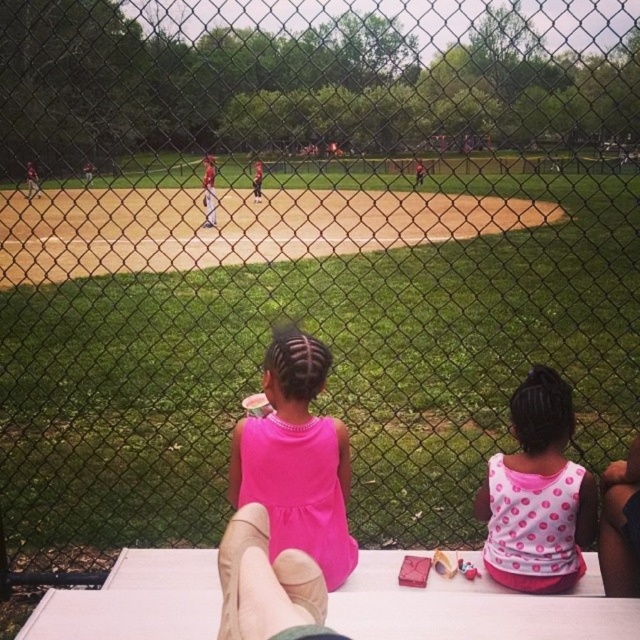
Question: Can you confirm if white wood picnic table at lower center is bigger than pink matte dress at center?

Choices:
 (A) yes
 (B) no

Answer: (B)

Question: Which point is farther to the camera?

Choices:
 (A) pink polka dot tank top at center
 (B) white wood picnic table at lower center
 (C) pink matte dress at center

Answer: (A)

Question: Which object is farther from the camera taking this photo?

Choices:
 (A) pink matte dress at center
 (B) white wood picnic table at lower center

Answer: (A)

Question: Is white wood picnic table at lower center to the left of pink matte dress at center from the viewer's perspective?

Choices:
 (A) yes
 (B) no

Answer: (B)

Question: From the image, what is the correct spatial relationship of white wood picnic table at lower center in relation to pink polka dot tank top at center?

Choices:
 (A) right
 (B) left

Answer: (B)

Question: Which object is farther from the camera taking this photo?

Choices:
 (A) pink polka dot tank top at center
 (B) pink matte dress at center

Answer: (A)